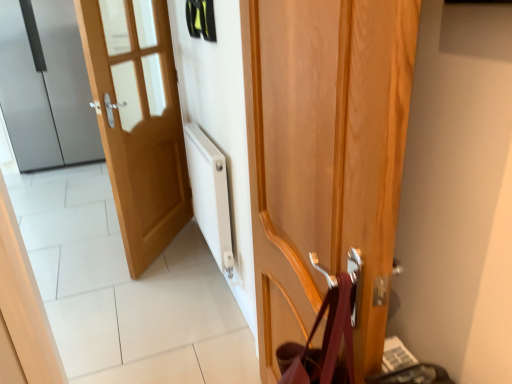
Question: Is satin silver refrigerator at left, marked as the third door in a front-to-back arrangement, oriented away from wooden door at center, marked as the first door in a front-to-back arrangement?

Choices:
 (A) yes
 (B) no

Answer: (B)

Question: Is satin silver refrigerator at left, marked as the third door in a front-to-back arrangement, placed right next to wooden door at center, marked as the first door in a front-to-back arrangement?

Choices:
 (A) yes
 (B) no

Answer: (B)

Question: Does satin silver refrigerator at left, marked as the third door in a front-to-back arrangement, appear on the left side of wooden door at center, marked as the first door in a right-to-left arrangement?

Choices:
 (A) no
 (B) yes

Answer: (B)

Question: Can you confirm if satin silver refrigerator at left, the first door when ordered from back to front, is smaller than wooden door at center, arranged as the 3th door when viewed from the back?

Choices:
 (A) no
 (B) yes

Answer: (A)

Question: From a real-world perspective, is satin silver refrigerator at left, which is the 1th door from left to right, over wooden door at center, marked as the first door in a right-to-left arrangement?

Choices:
 (A) no
 (B) yes

Answer: (B)

Question: Is satin silver refrigerator at left, marked as the third door in a front-to-back arrangement, inside the boundaries of light wood door at left, which appears as the 2th door when viewed from the back, or outside?

Choices:
 (A) inside
 (B) outside

Answer: (B)

Question: Based on their positions, is satin silver refrigerator at left, positioned as the 3th door in right-to-left order, located to the left or right of light wood door at left, positioned as the 2th door in left-to-right order?

Choices:
 (A) right
 (B) left

Answer: (B)

Question: Based on their sizes in the image, would you say satin silver refrigerator at left, marked as the third door in a front-to-back arrangement, is bigger or smaller than light wood door at left, which appears as the second door when viewed from the front?

Choices:
 (A) big
 (B) small

Answer: (A)

Question: In terms of width, does satin silver refrigerator at left, the first door when ordered from back to front, look wider or thinner when compared to light wood door at left, which appears as the 2th door when viewed from the back?

Choices:
 (A) thin
 (B) wide

Answer: (B)

Question: From the image's perspective, is wooden door at center, marked as the first door in a right-to-left arrangement, above or below light wood door at left, positioned as the 2th door in left-to-right order?

Choices:
 (A) above
 (B) below

Answer: (B)

Question: From their relative heights in the image, would you say wooden door at center, which ranks as the 3th door in left-to-right order, is taller or shorter than light wood door at left, positioned as the 2th door in left-to-right order?

Choices:
 (A) tall
 (B) short

Answer: (B)

Question: Does point (391, 130) appear closer or farther from the camera than point (141, 193)?

Choices:
 (A) farther
 (B) closer

Answer: (B)

Question: Is wooden door at center, arranged as the 3th door when viewed from the back, bigger or smaller than light wood door at left, which appears as the 2th door when viewed from the back?

Choices:
 (A) small
 (B) big

Answer: (B)

Question: Would you say light wood door at left, the 2th door viewed from the right, is to the left or to the right of wooden door at center, which ranks as the 3th door in left-to-right order, in the picture?

Choices:
 (A) right
 (B) left

Answer: (B)

Question: Is light wood door at left, positioned as the 2th door in left-to-right order, bigger or smaller than wooden door at center, marked as the first door in a front-to-back arrangement?

Choices:
 (A) big
 (B) small

Answer: (B)